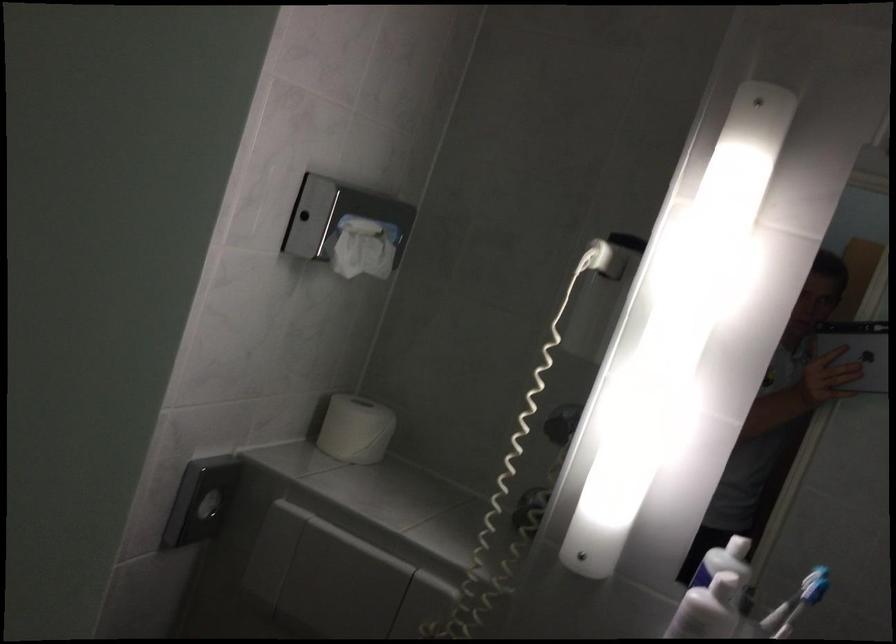
The image size is (896, 644). What do you see at coordinates (364, 247) in the screenshot?
I see `the dispensed facial tissue` at bounding box center [364, 247].